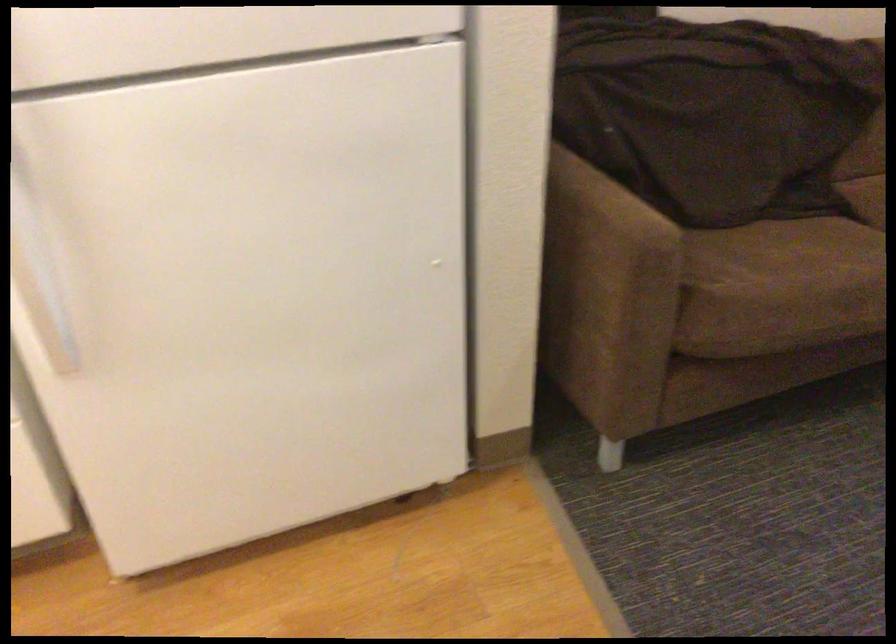
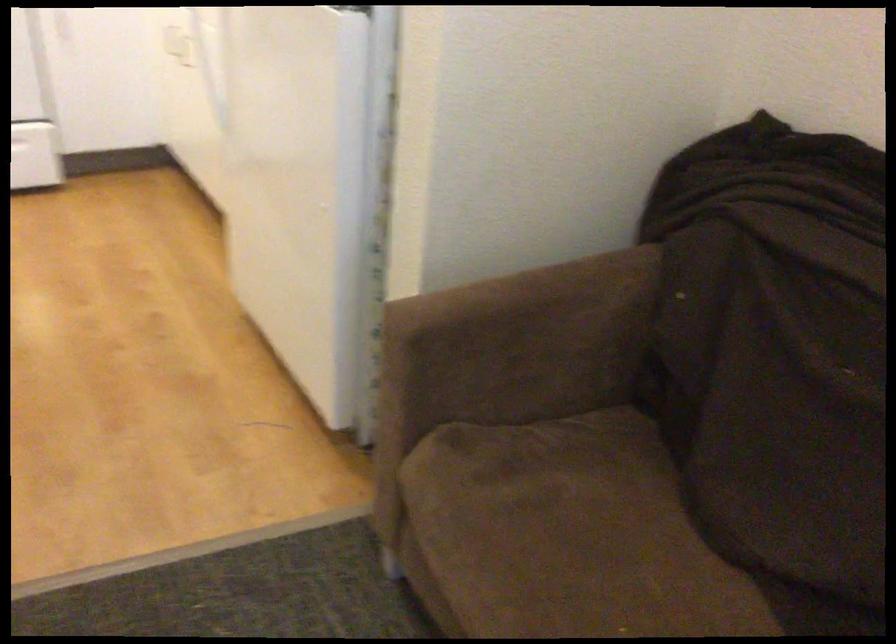
Where in the second image is the point corresponding to [602,192] from the first image?

(533, 310)